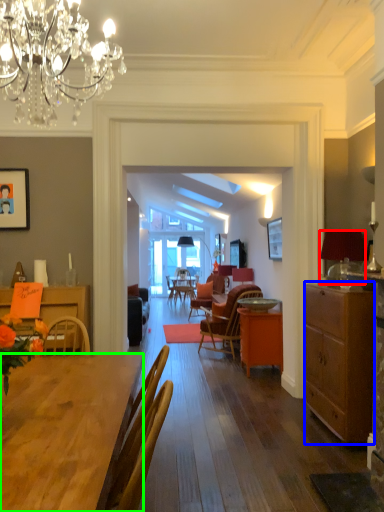
Question: Which object is positioned closest to lamp (highlighted by a red box)? Select from cabinetry (highlighted by a blue box) and desk (highlighted by a green box).

Choices:
 (A) cabinetry
 (B) desk

Answer: (A)